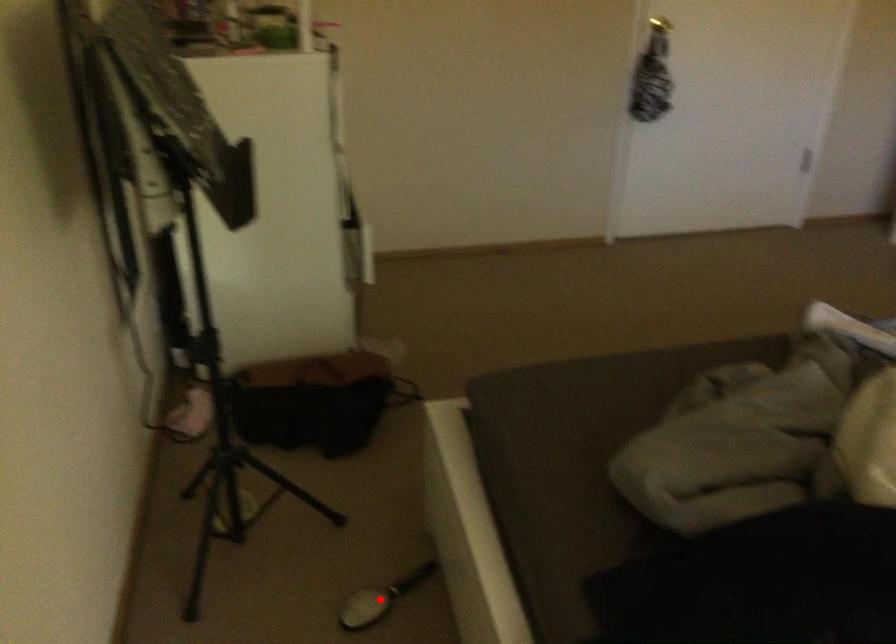
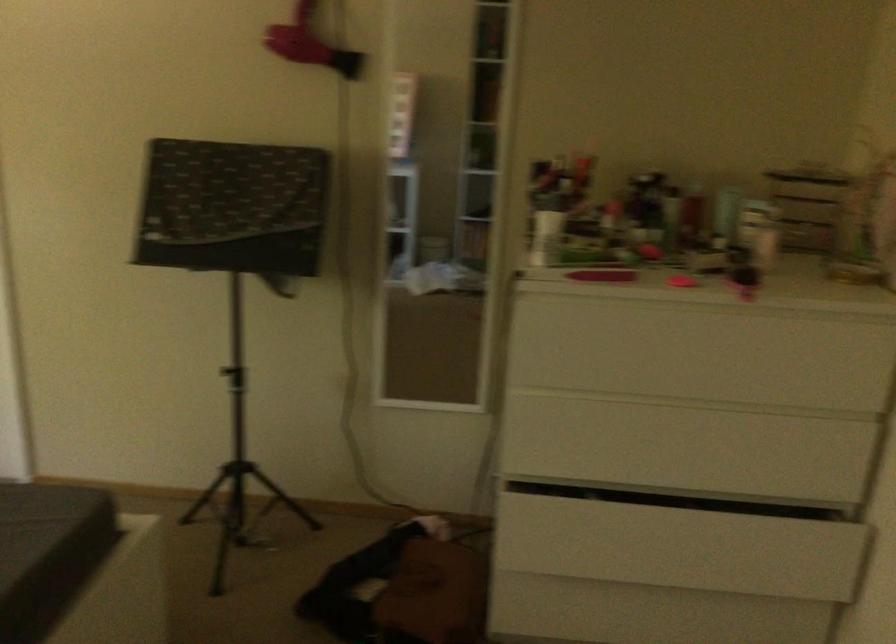
Question: I am providing you with two images of the same scene from different viewpoints. A red point is marked on the first image. At the location where the point appears in image 1, is it still visible in image 2?

Choices:
 (A) Yes
 (B) No

Answer: (B)